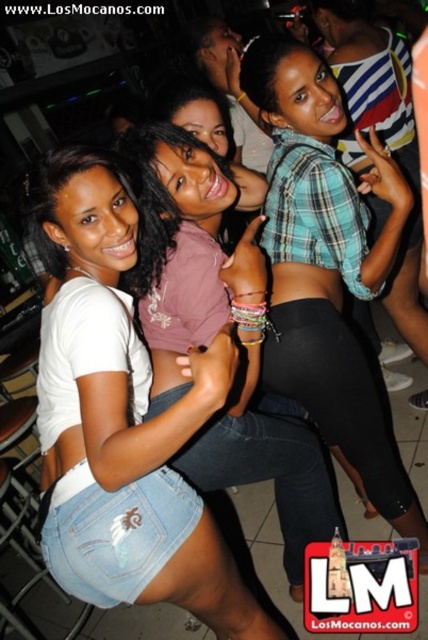
Question: Which of the following is the farthest from the observer?

Choices:
 (A) plaid fabric shirt at center
 (B) denim shorts at center

Answer: (A)

Question: Can you confirm if plaid fabric shirt at center is positioned to the right of plaid fabric crop top at center?

Choices:
 (A) yes
 (B) no

Answer: (B)

Question: Which object is farther from the camera taking this photo?

Choices:
 (A) plaid fabric crop top at center
 (B) plaid fabric shirt at center
 (C) denim shorts at center

Answer: (A)

Question: Is plaid fabric shirt at center bigger than plaid fabric crop top at center?

Choices:
 (A) yes
 (B) no

Answer: (B)

Question: Which of the following is the closest to the observer?

Choices:
 (A) denim shorts at center
 (B) plaid fabric crop top at center
 (C) plaid fabric shirt at center

Answer: (A)

Question: Can you confirm if denim shorts at center is bigger than plaid fabric shirt at center?

Choices:
 (A) yes
 (B) no

Answer: (A)